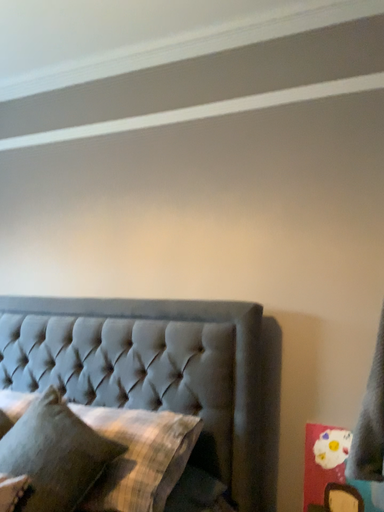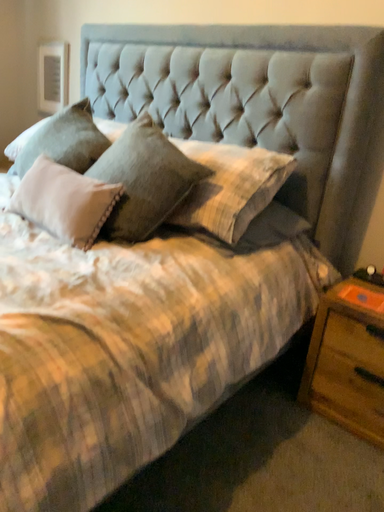
Question: How did the camera likely rotate when shooting the video?

Choices:
 (A) rotated right
 (B) rotated left

Answer: (B)